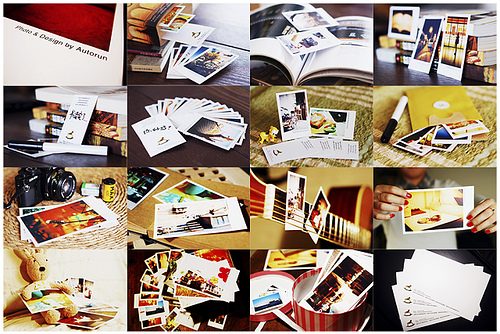
At what (x,y) coordinates should I click in order to perform the action: click on marker. Please return your answer as a coordinate pair (x, y). Looking at the image, I should click on (392, 119).